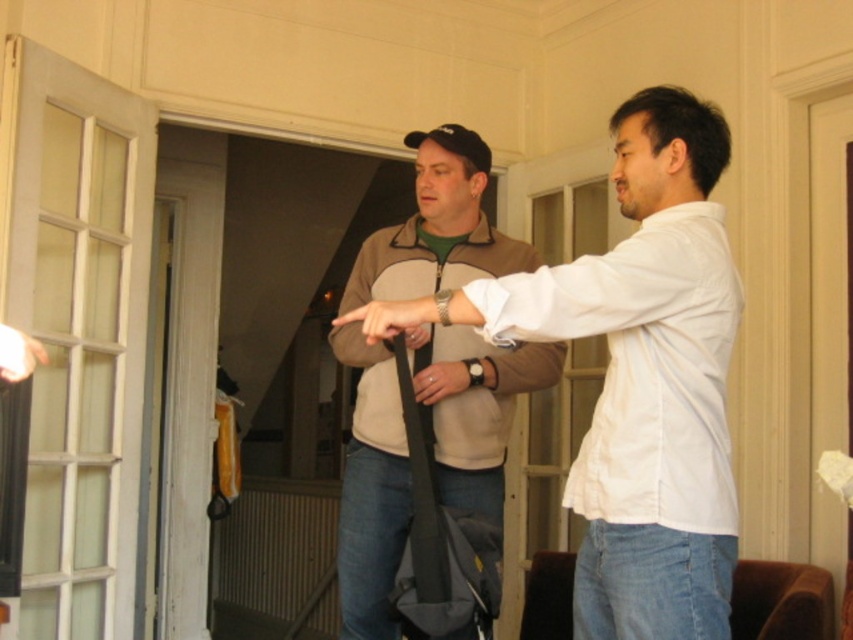
Question: Does matte gray bag at center appear over white matte hand at upper left?

Choices:
 (A) no
 (B) yes

Answer: (B)

Question: Can you confirm if matte gray bag at center is bigger than matte black bag at center?

Choices:
 (A) yes
 (B) no

Answer: (A)

Question: Which of these objects is positioned farthest from the white matte hand at upper left?

Choices:
 (A) black fabric strap at center
 (B) matte black hand at center

Answer: (A)

Question: Which object is the farthest from the black fabric strap at center?

Choices:
 (A) white matte hand at upper left
 (B) matte black bag at center

Answer: (A)

Question: Based on their relative distances, which object is farther from the matte gray bag at center?

Choices:
 (A) black fabric strap at center
 (B) matte black hand at center
 (C) white matte hand at upper left

Answer: (C)

Question: Does matte gray bag at center appear over white matte hand at upper left?

Choices:
 (A) no
 (B) yes

Answer: (B)